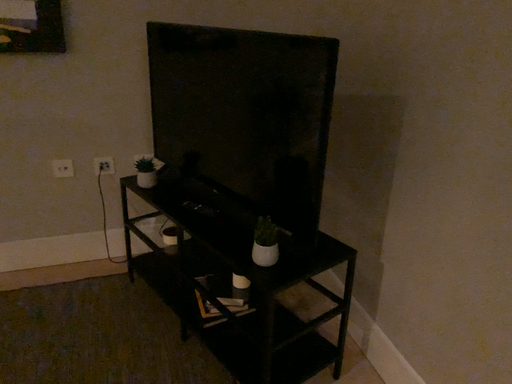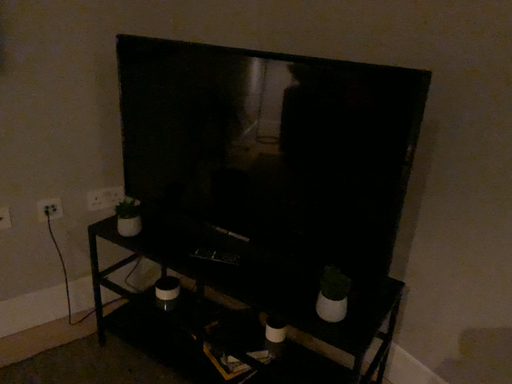
Question: Which way did the camera rotate in the video?

Choices:
 (A) rotated left
 (B) rotated right

Answer: (B)